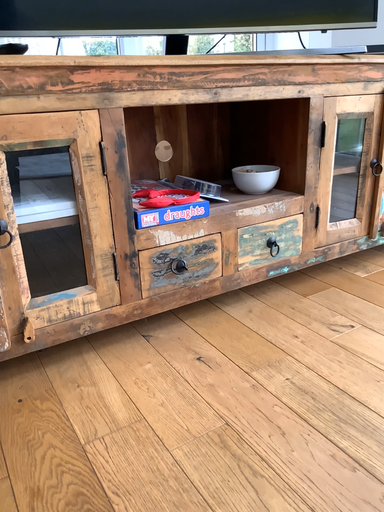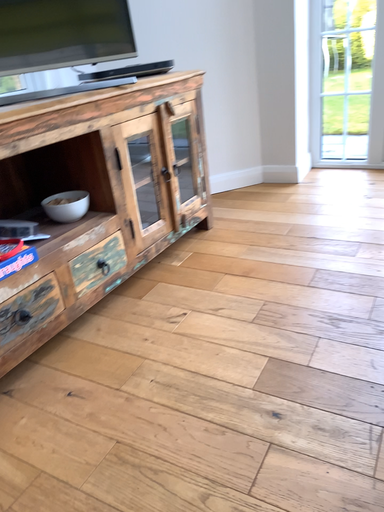
Question: Which way did the camera rotate in the video?

Choices:
 (A) rotated right
 (B) rotated left

Answer: (A)